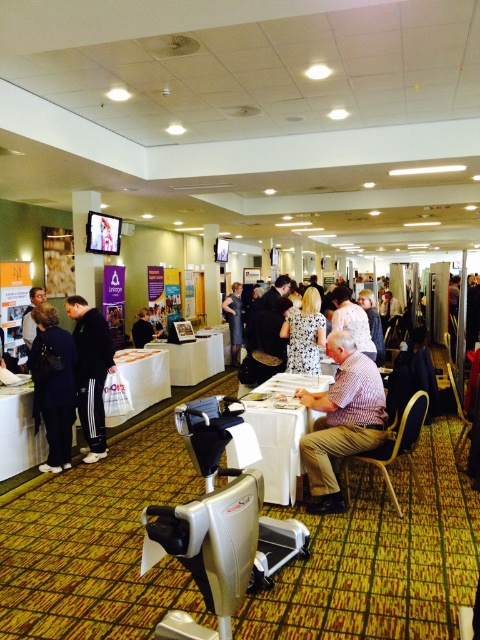
Question: Does white cloth table at center appear over white paper bag at center?

Choices:
 (A) no
 (B) yes

Answer: (A)

Question: Is dark blue fabric jacket at left positioned at the back of black fabric jacket at center?

Choices:
 (A) no
 (B) yes

Answer: (A)

Question: Does plaid shirt at center have a greater width compared to white cloth table at center?

Choices:
 (A) no
 (B) yes

Answer: (A)

Question: Which point is closer to the camera?

Choices:
 (A) (97, 403)
 (B) (357, 353)

Answer: (B)

Question: Which is nearer to the white dotted dress at center?

Choices:
 (A) white fabric table at center
 (B) black fabric jacket at center
 (C) white cloth table at center

Answer: (C)

Question: Estimate the real-world distances between objects in this image. Which object is farther from the white fabric dress at center?

Choices:
 (A) dark blue fabric jacket at left
 (B) white dotted dress at center

Answer: (A)